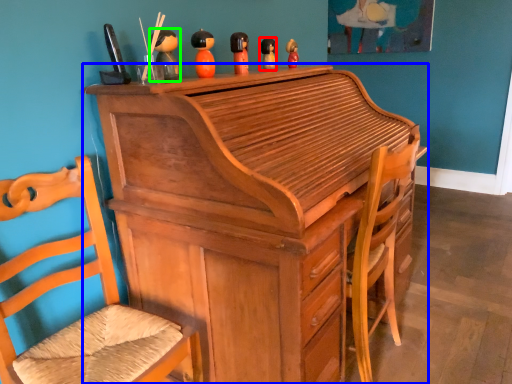
Question: Considering the real-world distances, which object is farthest from toy (highlighted by a red box)? desk (highlighted by a blue box) or toy (highlighted by a green box)?

Choices:
 (A) desk
 (B) toy

Answer: (A)